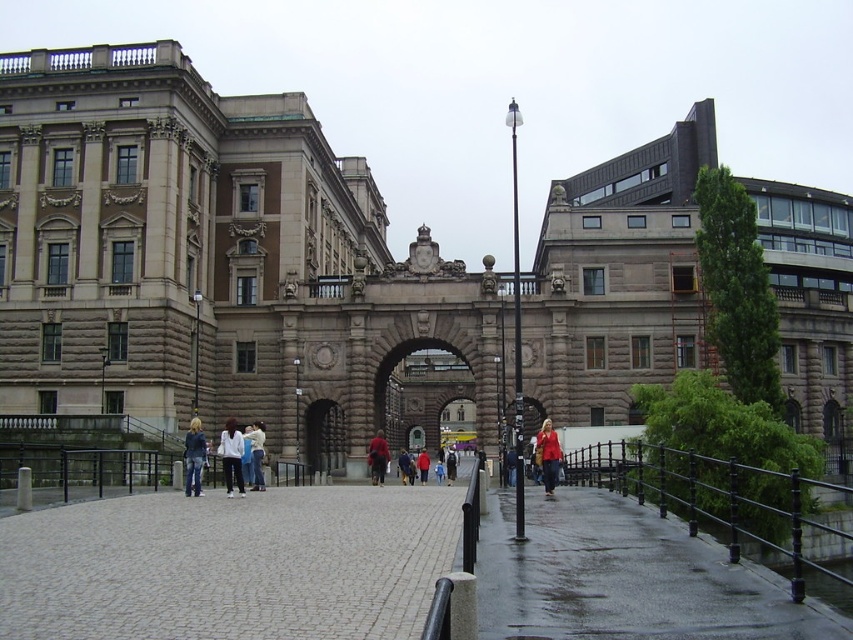
Question: Can you confirm if brown stone palace at center is positioned to the right of dark blue jeans at center?

Choices:
 (A) no
 (B) yes

Answer: (A)

Question: Can you confirm if brown stone archway at center is positioned to the right of red matte jacket at center?

Choices:
 (A) no
 (B) yes

Answer: (B)

Question: Which object appears farthest from the camera in this image?

Choices:
 (A) brown stone palace at center
 (B) white cotton shirt at center

Answer: (A)

Question: Does wet concrete pavement at lower right have a smaller size compared to red leather jacket at center?

Choices:
 (A) no
 (B) yes

Answer: (A)

Question: Which is farther from the dark blue jeans at center?

Choices:
 (A) matte red coat at center
 (B) denim pants at center

Answer: (B)

Question: Which of the following is the closest to the observer?

Choices:
 (A) matte red coat at center
 (B) brown stone archway at center

Answer: (A)